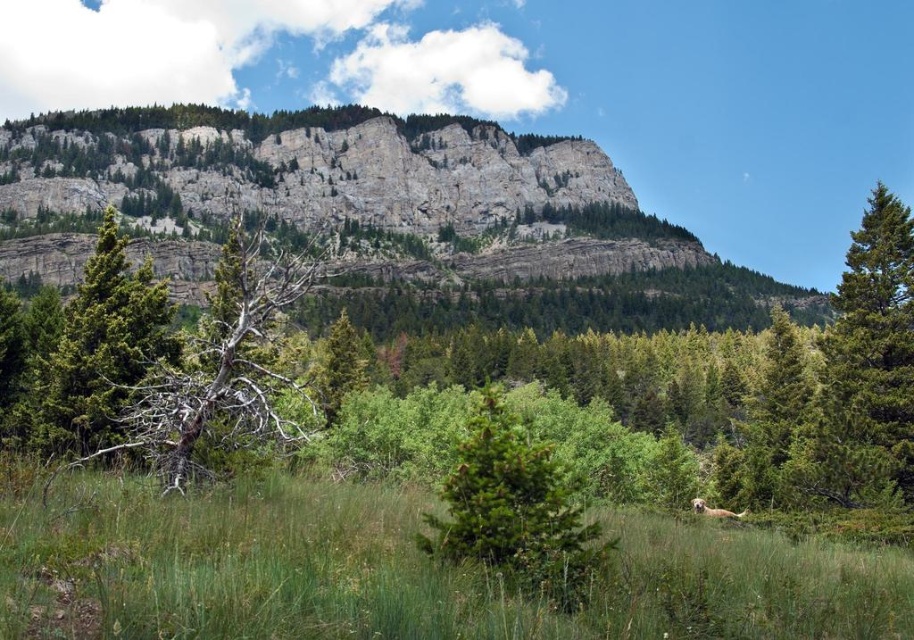
Question: In this image, where is green grassy at center located relative to green matte tree at center?

Choices:
 (A) below
 (B) above

Answer: (A)

Question: Is gray rock cliff at upper center bigger than green matte tree at center?

Choices:
 (A) no
 (B) yes

Answer: (B)

Question: Is gray bark tree at center-left below green matte tree at center?

Choices:
 (A) yes
 (B) no

Answer: (B)

Question: Among these points, which one is nearest to the camera?

Choices:
 (A) (150, 356)
 (B) (301, 221)

Answer: (A)

Question: Which is nearer to the green matte tree at center?

Choices:
 (A) gray rock cliff at upper center
 (B) green matte tree at right
 (C) gray bark tree at center-left

Answer: (C)

Question: Based on their relative distances, which object is nearer to the gray rock cliff at upper center?

Choices:
 (A) green matte tree at right
 (B) green matte tree at center
 (C) green grassy at center

Answer: (A)